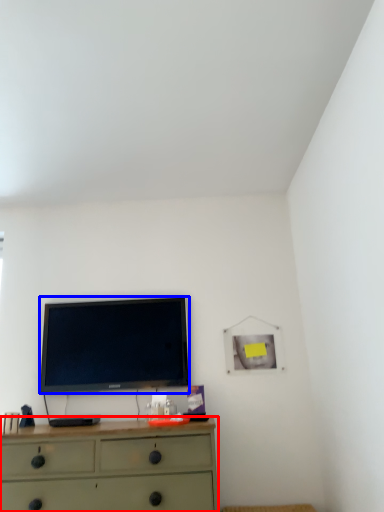
Question: Among these objects, which one is farthest to the camera, chest of drawers (highlighted by a red box) or television (highlighted by a blue box)?

Choices:
 (A) chest of drawers
 (B) television

Answer: (B)